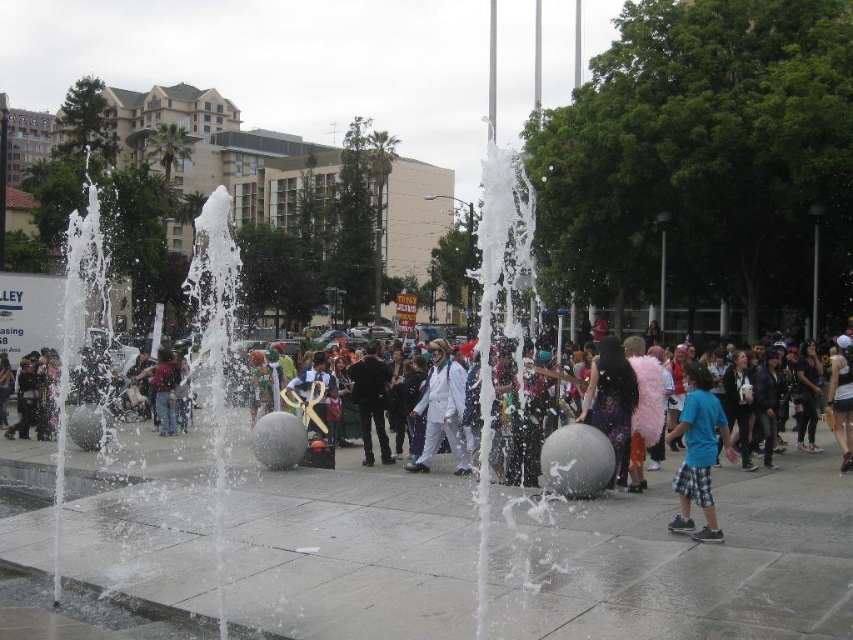
Question: Which point appears closest to the camera in this image?

Choices:
 (A) (590, 426)
 (B) (221, 563)
 (C) (708, 458)

Answer: (B)

Question: Can you confirm if white glossy water at center is thinner than white matte suit at center?

Choices:
 (A) no
 (B) yes

Answer: (A)

Question: Can you confirm if white glossy water at center is positioned below blue plaid shorts at lower right?

Choices:
 (A) no
 (B) yes

Answer: (A)

Question: Does white glossy water at center have a greater width compared to white fluffy coat at center?

Choices:
 (A) yes
 (B) no

Answer: (A)

Question: Which point is closer to the camera taking this photo?

Choices:
 (A) (450, 412)
 (B) (53, 563)

Answer: (B)

Question: Among these points, which one is farthest from the camera?

Choices:
 (A) (700, 529)
 (B) (439, 394)

Answer: (B)